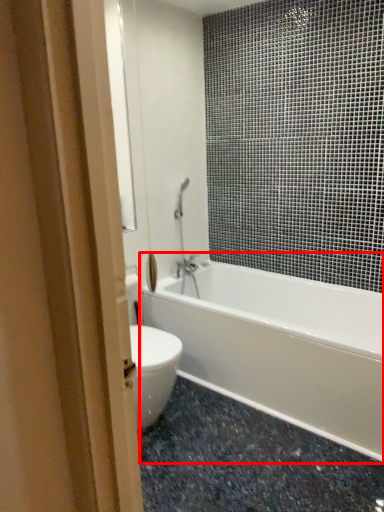
Question: Where is bathtub (annotated by the red box) located in relation to granite in the image?

Choices:
 (A) right
 (B) left

Answer: (A)